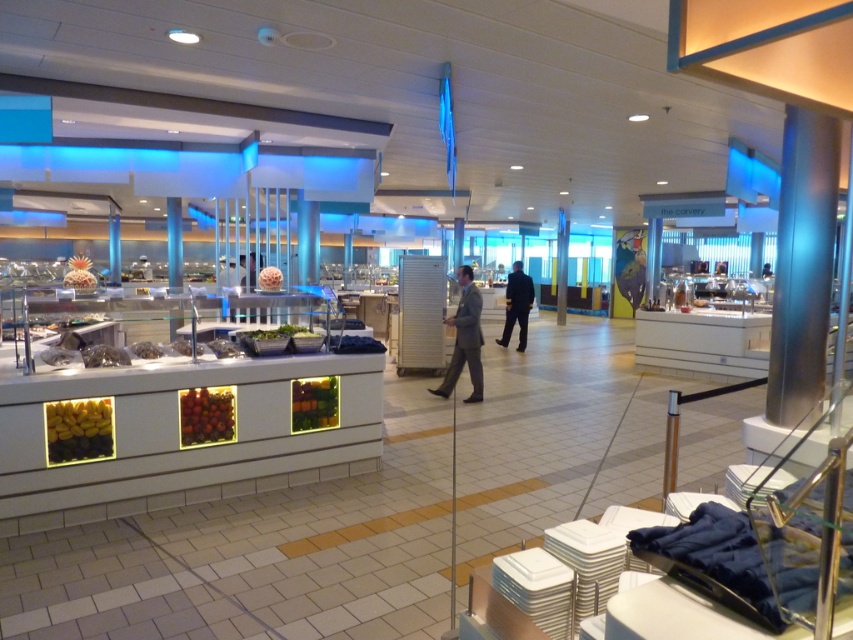
From the picture: You are a customer at the food court and want to reach the dark blue suit at center to ask a question. However, there are yellow bananas at lower left blocking your path. Can you walk around them? Explain why or why not based on their positions.

The yellow bananas at lower left are in front of the dark blue suit at center, meaning they are closer to you. Since the bananas are blocking your path, you can walk around them to reach the dark blue suit at center as they are not fixed objects and can be navigated around.